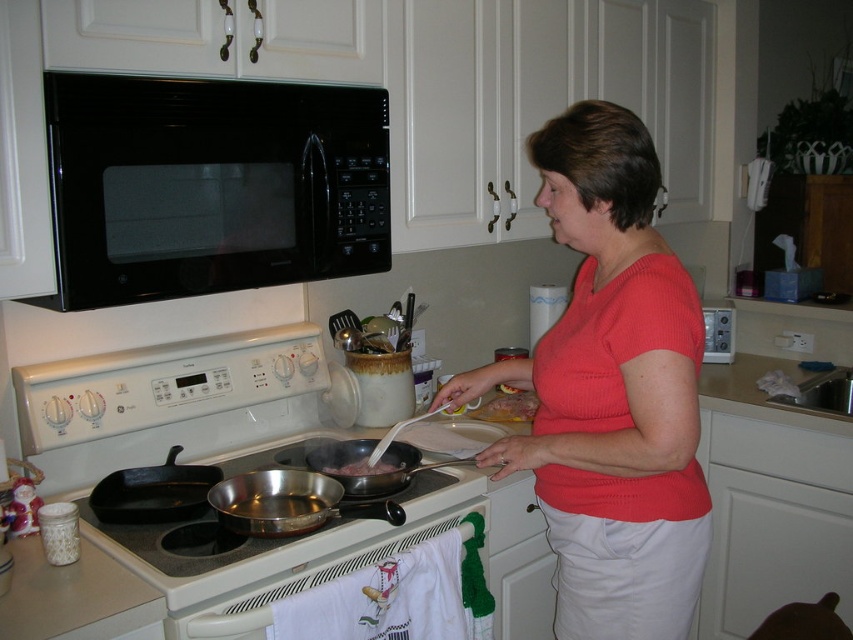
Between black glass microwave at upper center and shiny silver wok at center, which one has more height?

Standing taller between the two is black glass microwave at upper center.

Identify the location of black glass microwave at upper center. tap(210, 186).

Is knitted red sweater at center closer to the viewer compared to dark brown meat at stove top?

Yes, it is.

Between point (642, 508) and point (343, 468), which one is positioned in front?

Point (642, 508) is in front.

Which is in front, point (598, 365) or point (373, 461)?

Point (598, 365) is more forward.

At what (x,y) coordinates should I click in order to perform the action: click on knitted red sweater at center. Please return your answer as a coordinate pair (x, y). Image resolution: width=853 pixels, height=640 pixels. Looking at the image, I should click on (610, 392).

Does knitted red sweater at center have a greater height compared to black glass microwave at upper center?

Correct, knitted red sweater at center is much taller as black glass microwave at upper center.

Is point (599, 394) less distant than point (251, 108)?

Yes, point (599, 394) is closer to viewer.

Locate an element on the screen. knitted red sweater at center is located at coordinates (610, 392).